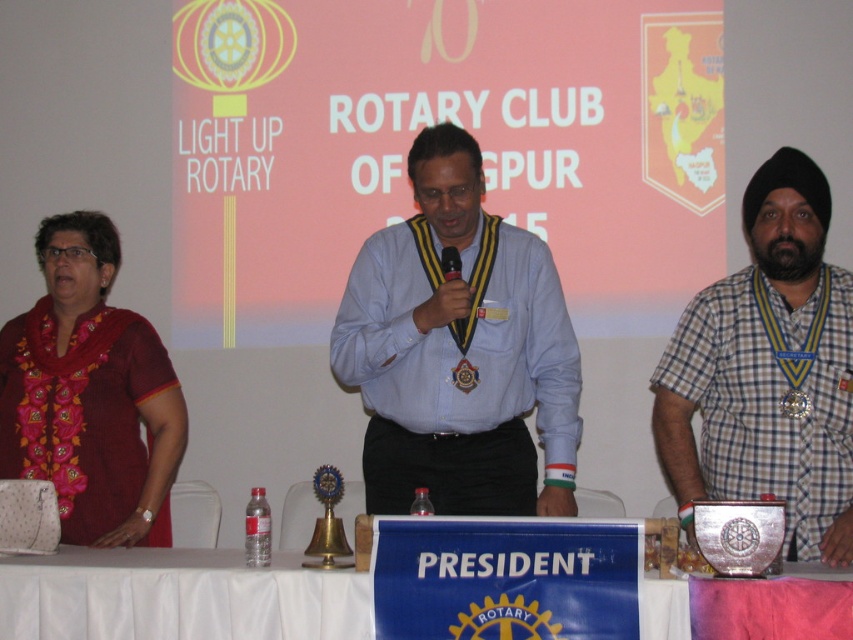
Can you confirm if blue shirt at center is positioned above checkered fabric shirt at right?

Indeed, blue shirt at center is positioned over checkered fabric shirt at right.

Does blue shirt at center appear under checkered fabric shirt at right?

Incorrect, blue shirt at center is not positioned below checkered fabric shirt at right.

Between point (525, 342) and point (766, 225), which one is positioned in front?

Point (766, 225) is more forward.

Identify the location of blue shirt at center. This screenshot has width=853, height=640. (459, 352).

Does checkered fabric shirt at right come in front of gold metallic medal at center?

Yes, checkered fabric shirt at right is closer to the viewer.

Can you confirm if checkered fabric shirt at right is positioned to the left of gold metallic medal at center?

Correct, you'll find checkered fabric shirt at right to the left of gold metallic medal at center.

Find the location of a particular element. checkered fabric shirt at right is located at coordinates (767, 371).

Based on the photo, is blue shirt at center to the left of embroidered silk saree at left from the viewer's perspective?

Incorrect, blue shirt at center is not on the left side of embroidered silk saree at left.

Who is positioned more to the left, blue shirt at center or embroidered silk saree at left?

embroidered silk saree at left

Does point (415, 182) come farther from viewer compared to point (36, 372)?

That is False.

Locate an element on the screen. blue shirt at center is located at coordinates (459, 352).